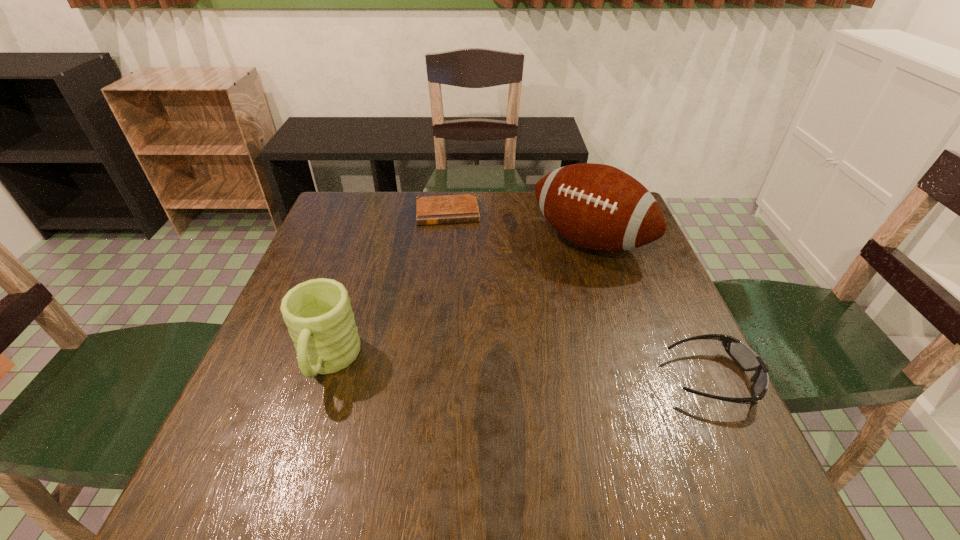
What are the coordinates of `vacant space positioned on the laces of the football` in the screenshot? It's located at (518, 309).

This screenshot has width=960, height=540. I want to click on vacant region located on the laces of the football, so click(x=532, y=294).

At what (x,y) coordinates should I click in order to perform the action: click on free space located 0.280m on the laces of the football. Please return your answer as a coordinate pair (x, y). This screenshot has width=960, height=540. Looking at the image, I should click on (498, 329).

This screenshot has width=960, height=540. What are the coordinates of `diary positioned at the far edge` in the screenshot? It's located at (453, 208).

Identify the location of football present at the far edge. Image resolution: width=960 pixels, height=540 pixels. (596, 206).

The height and width of the screenshot is (540, 960). I want to click on object located in the near edge section of the desktop, so click(746, 359).

Image resolution: width=960 pixels, height=540 pixels. Identify the location of object located at the left edge. (317, 312).

I want to click on sunglasses located in the right edge section of the desktop, so click(x=746, y=359).

The image size is (960, 540). I want to click on football that is at the right edge, so click(x=596, y=206).

Find the location of a particular element. This screenshot has width=960, height=540. object that is at the far right corner is located at coordinates (596, 206).